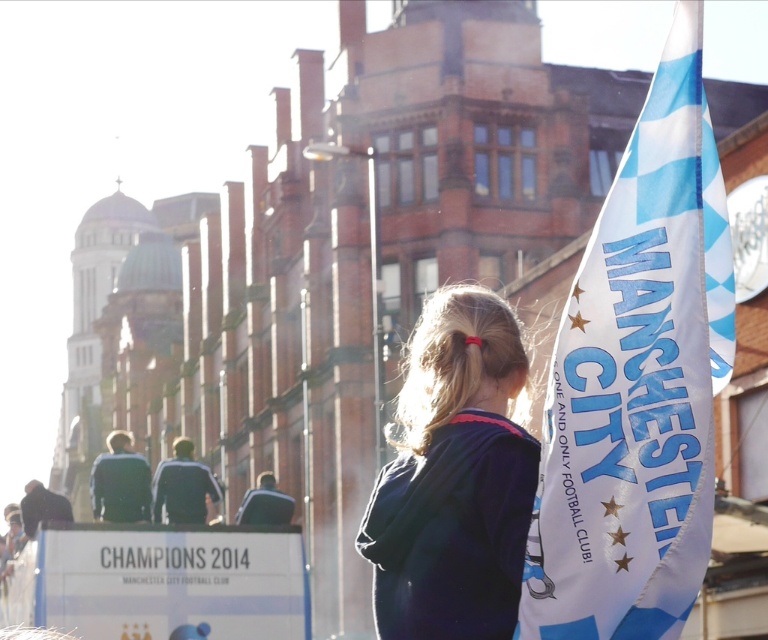
Question: Which of the following is the farthest from the observer?

Choices:
 (A) dark blue sweater at center
 (B) white fabric manchester city flag at right

Answer: (A)

Question: Can you confirm if white fabric manchester city flag at right is positioned above dark blue sweater at center?

Choices:
 (A) yes
 (B) no

Answer: (A)

Question: Which point is farther to the camera?

Choices:
 (A) white fabric manchester city flag at right
 (B) dark blue sweater at center

Answer: (B)

Question: Which point is farther to the camera?

Choices:
 (A) (432, 310)
 (B) (531, 627)

Answer: (A)

Question: Can you confirm if white fabric manchester city flag at right is bigger than dark blue sweater at center?

Choices:
 (A) yes
 (B) no

Answer: (B)

Question: Can you confirm if white fabric manchester city flag at right is positioned to the left of dark blue sweater at center?

Choices:
 (A) no
 (B) yes

Answer: (A)